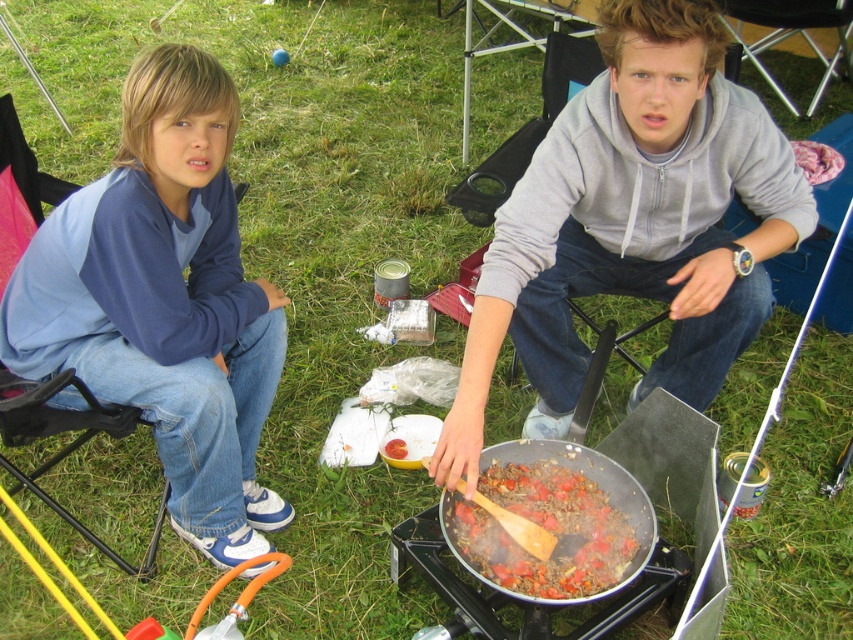
You are planning to take a photo of the two people in the scene. Since you want to focus on the person cooking, which of the two, the gray hoodie at center or the blue cotton sweatshirt at left, is positioned closer to the camera?

The gray hoodie at center is positioned closer to the camera than the blue cotton sweatshirt at left because it is in front of the blue cotton sweatshirt at left.

You are standing in the campsite and want to hand the brown matte wooden spoon at center to the person wearing the blue cotton sweatshirt at left. Which direction should you move the spoon to give it to them?

You should move the spoon to the left because the blue cotton sweatshirt at left is to the left of the brown matte wooden spoon at center.